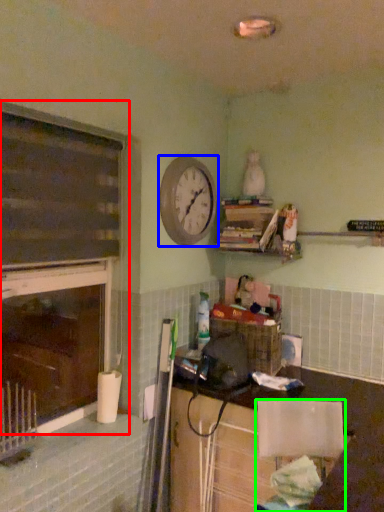
Question: Which object is positioned closest to window frame (highlighted by a red box)? Select from clock (highlighted by a blue box) and chair (highlighted by a green box).

Choices:
 (A) clock
 (B) chair

Answer: (A)